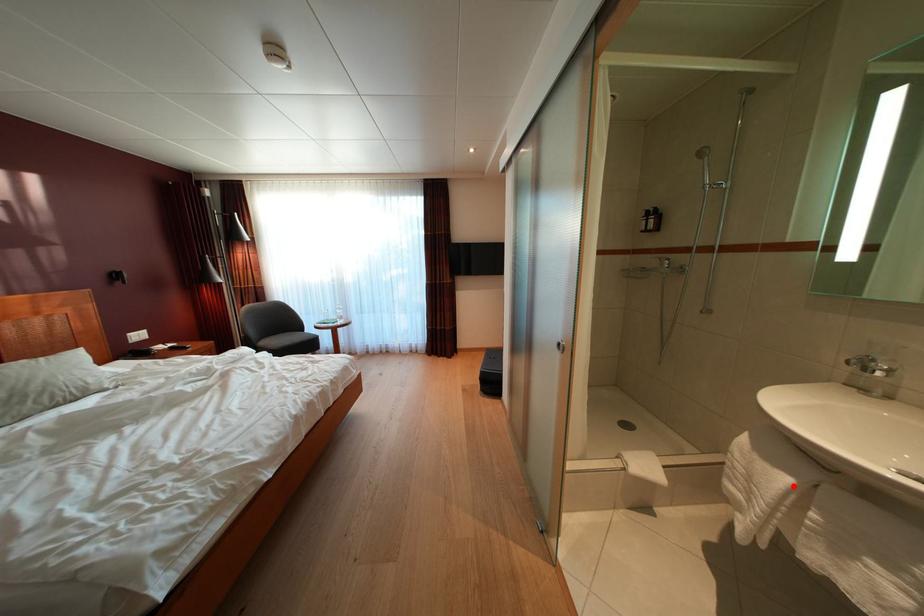
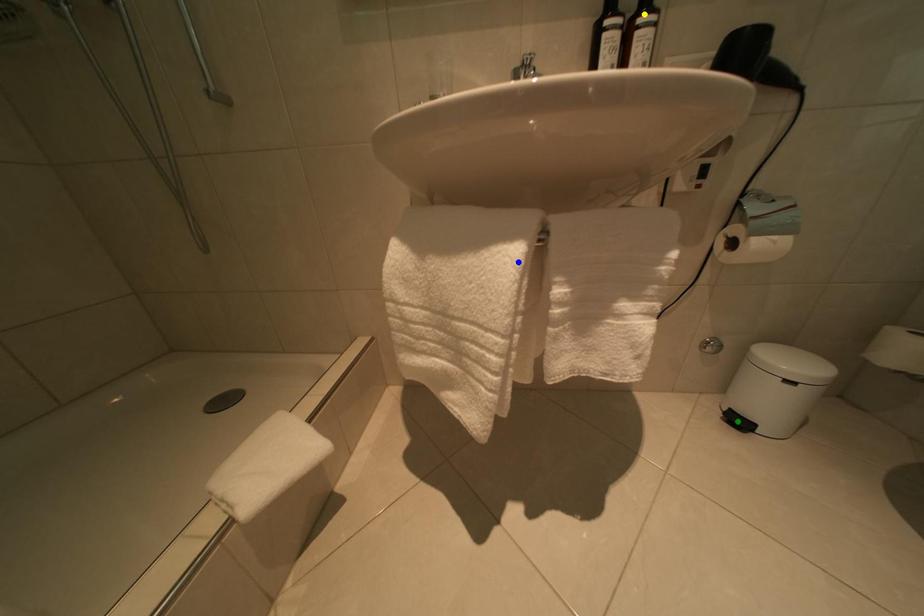
Question: I am providing you with two images of the same scene from different viewpoints. A red point is marked on the first image. You are given multiple points on the second image. Which point in image 2 is actually the same real-world point as the red point in image 1?

Choices:
 (A) green point
 (B) yellow point
 (C) blue point

Answer: (C)